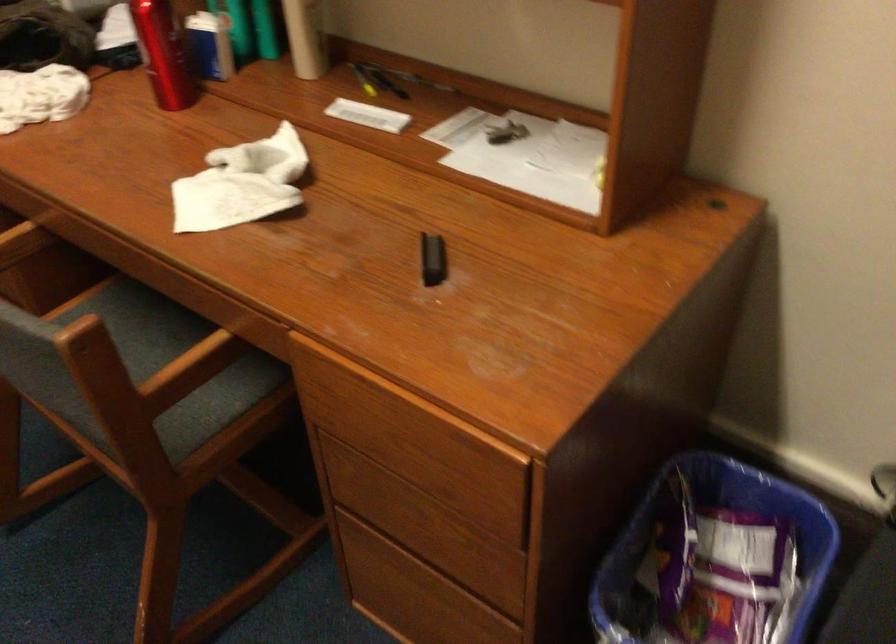
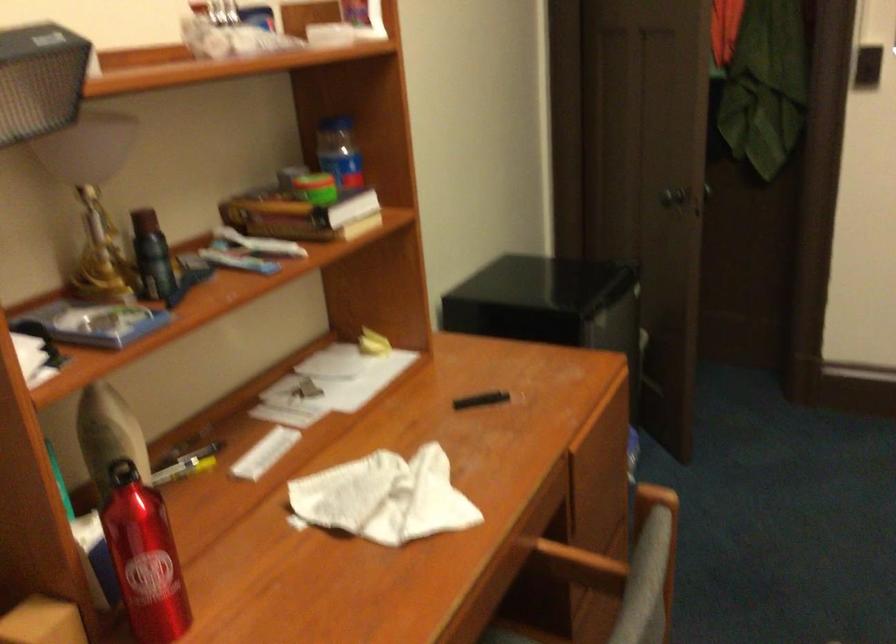
In the second image, find the point that corresponds to [185,362] in the first image.

(579, 565)